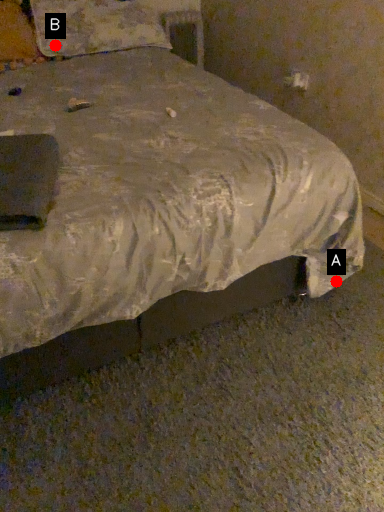
Question: Two points are circled on the image, labeled by A and B beside each circle. Among these points, which one is nearest to the camera?

Choices:
 (A) A is closer
 (B) B is closer

Answer: (A)